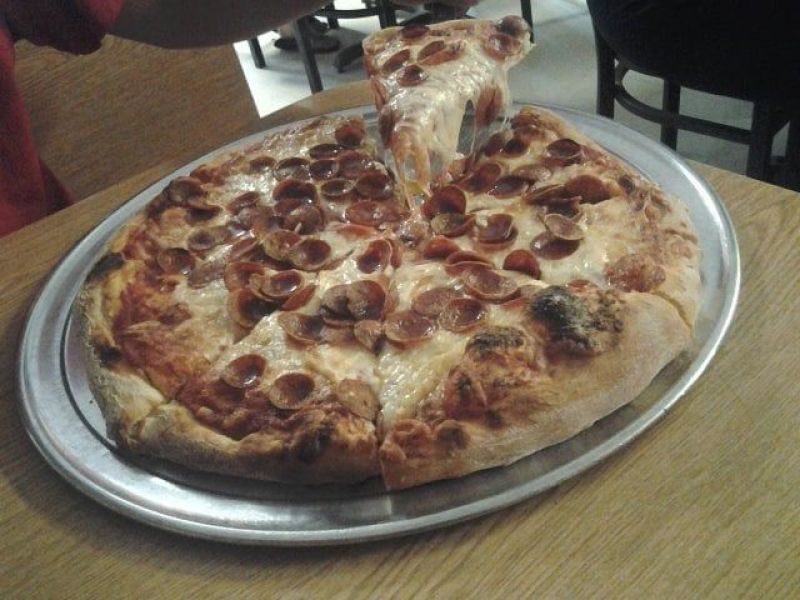
Find the location of a particular element. wooden tabletop is located at coordinates (x=749, y=486).